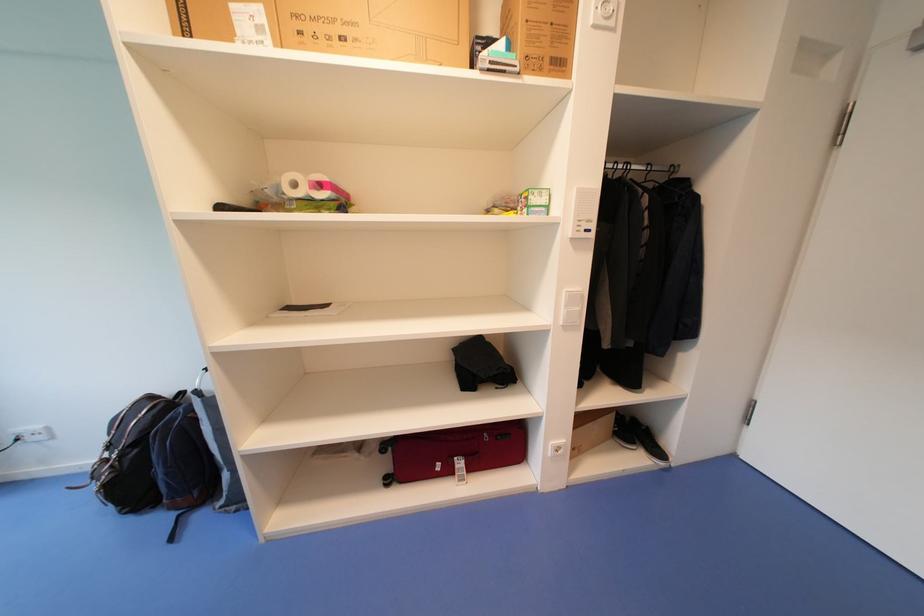
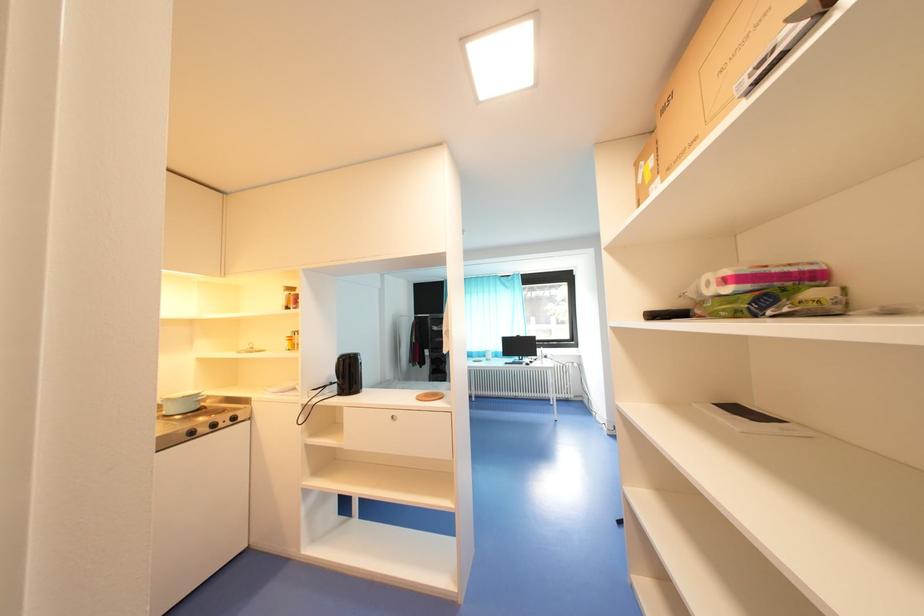
Question: The first image is from the beginning of the video and the second image is from the end. How did the camera likely rotate when shooting the video?

Choices:
 (A) Left
 (B) Right
 (C) Up
 (D) Down

Answer: (A)